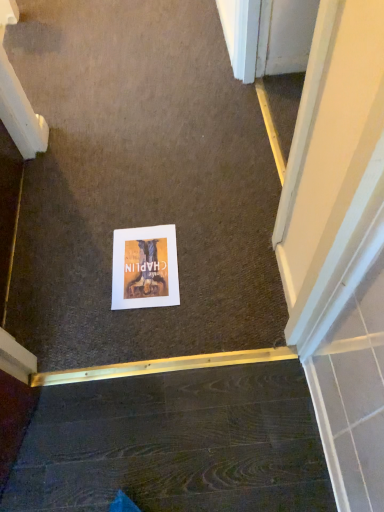
The image size is (384, 512). What are the coordinates of `white paper at center` in the screenshot? It's located at (145, 268).

What do you see at coordinates (145, 268) in the screenshot? I see `white paper at center` at bounding box center [145, 268].

Measure the distance between white paper at center and camera.

The depth of white paper at center is 1.30 meters.

Identify the location of white paper at center. This screenshot has width=384, height=512. (145, 268).